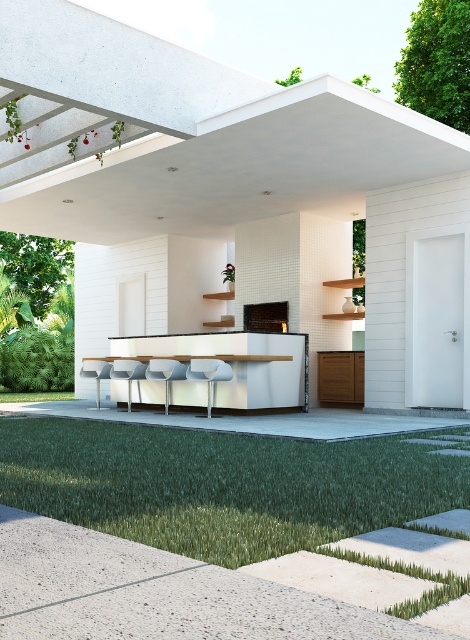
Question: Can you confirm if white concrete pergola at upper center is positioned to the left of green grass at lower center?

Choices:
 (A) no
 (B) yes

Answer: (B)

Question: Is the position of white concrete pergola at upper center less distant than that of green grass at lower center?

Choices:
 (A) yes
 (B) no

Answer: (B)

Question: Is white concrete pergola at upper center thinner than green grass at lower center?

Choices:
 (A) yes
 (B) no

Answer: (B)

Question: Which object appears farthest from the camera in this image?

Choices:
 (A) white concrete pergola at upper center
 (B) green grass at lower center

Answer: (A)